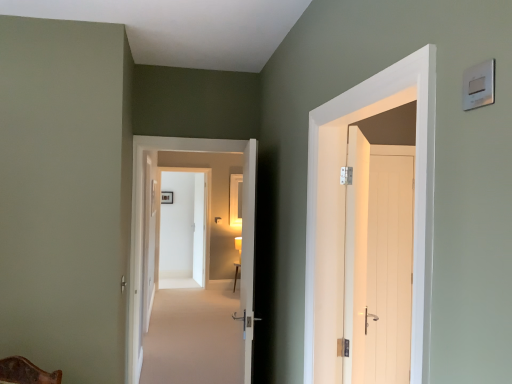
Question: Is point (416, 278) positioned closer to the camera than point (481, 62)?

Choices:
 (A) farther
 (B) closer

Answer: (A)

Question: Considering the positions of white wooden door at upper right, positioned as the 5th door in left-to-right order, and silver metallic light switch at upper right in the image, is white wooden door at upper right, positioned as the 5th door in left-to-right order, taller or shorter than silver metallic light switch at upper right?

Choices:
 (A) short
 (B) tall

Answer: (B)

Question: Considering the real-world distances, which object is closest to the silver metallic light switch at upper right?

Choices:
 (A) white wood door at right, the fourth door from the front
 (B) white wooden door at center, placed as the 4th door when sorted from left to right
 (C) white wooden door at center, which ranks as the 5th door in right-to-left order
 (D) white glossy door at center, the 5th door positioned from the front
 (E) white wooden door at upper right, positioned as the 5th door in left-to-right order

Answer: (E)

Question: Considering the real-world distances, which object is farthest from the white wooden door at center, the second door viewed from the front?

Choices:
 (A) white glossy door at center, placed as the 1th door when sorted from left to right
 (B) white wood door at right, the 6th door when ordered from left to right
 (C) silver metallic light switch at upper right
 (D) white wooden door at center, acting as the sixth door starting from the front
 (E) wooden table at center

Answer: (D)